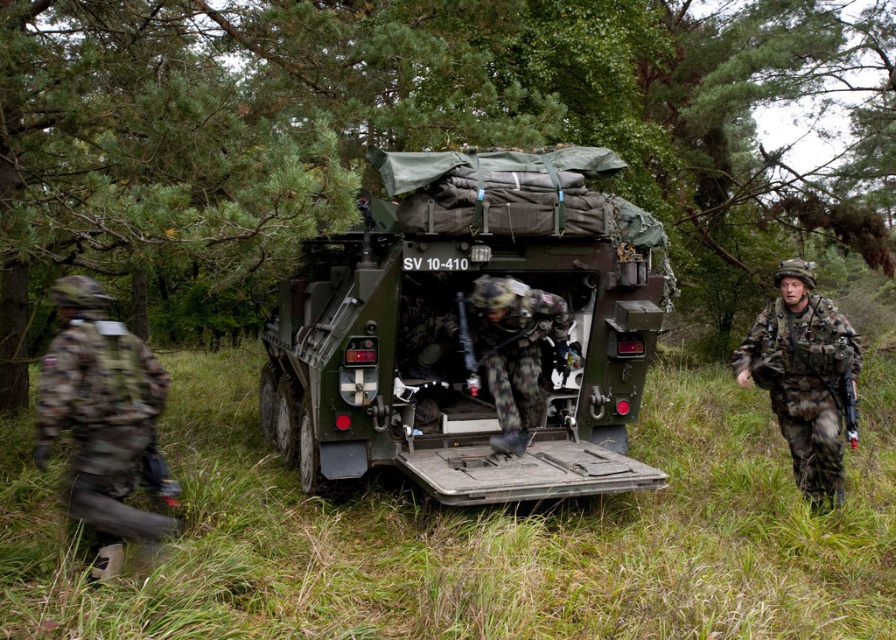
You are a soldier trying to board the camouflage fabric armored personnel carrier at center. The camouflage fabric uniform at right is blocking your path. Which direction should you move to reach the carrier without going around the uniform?

You should move to the left since the camouflage fabric armored personnel carrier at center is to the left of the camouflage fabric uniform at right.

Based on the scene description, can you determine which object is taller between the green grassy at center and the camouflage fabric armored personnel carrier at center?

The camouflage fabric armored personnel carrier at center is taller than the green grassy at center.